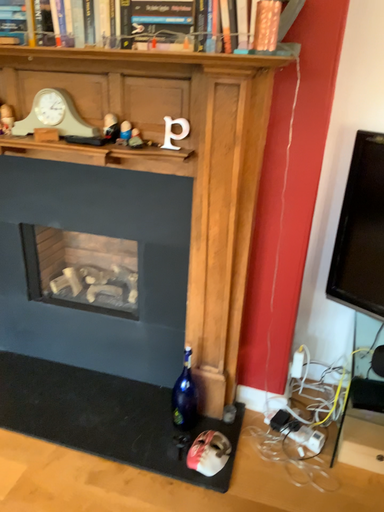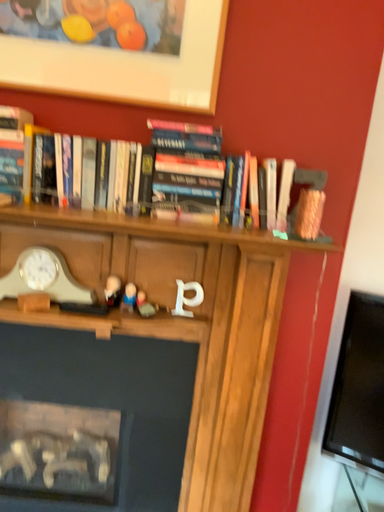
Question: Which way did the camera rotate in the video?

Choices:
 (A) rotated upward
 (B) rotated downward

Answer: (A)